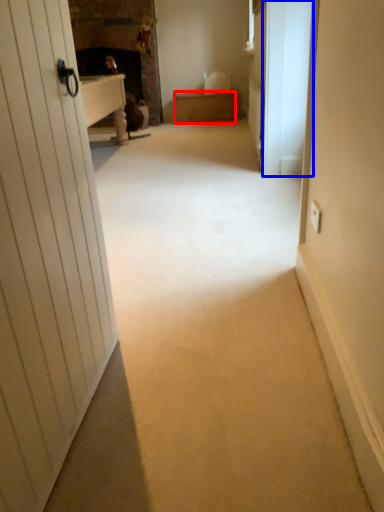
Question: Which object is closer to the camera taking this photo, furniture (highlighted by a red box) or screen door (highlighted by a blue box)?

Choices:
 (A) furniture
 (B) screen door

Answer: (B)